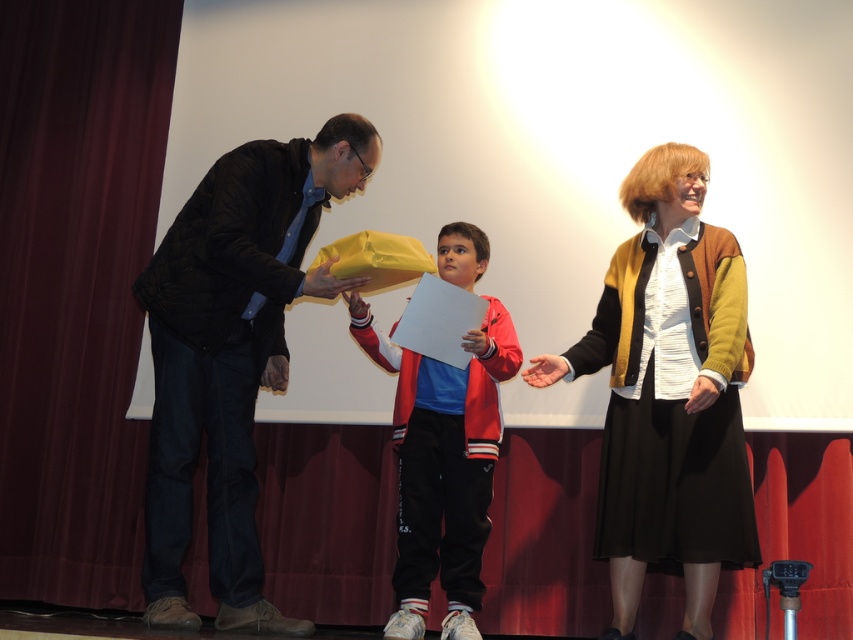
Question: Which is nearer to the matte black jacket at left?

Choices:
 (A) black woolen cardigan at center
 (B) matte red jacket at center
 (C) maroon fabric curtain at left

Answer: (B)

Question: Can you confirm if matte black jacket at left is positioned to the left of black woolen cardigan at center?

Choices:
 (A) no
 (B) yes

Answer: (B)

Question: Estimate the real-world distances between objects in this image. Which object is closer to the matte red jacket at center?

Choices:
 (A) black woolen cardigan at center
 (B) matte black jacket at left
 (C) maroon fabric curtain at left

Answer: (B)

Question: Which of the following is the farthest from the observer?

Choices:
 (A) maroon fabric curtain at left
 (B) black woolen cardigan at center
 (C) matte black jacket at left
 (D) matte red jacket at center

Answer: (A)

Question: Where is maroon fabric curtain at left located in relation to matte black jacket at left in the image?

Choices:
 (A) right
 (B) left

Answer: (B)

Question: Is maroon fabric curtain at left to the left of matte red jacket at center from the viewer's perspective?

Choices:
 (A) yes
 (B) no

Answer: (A)